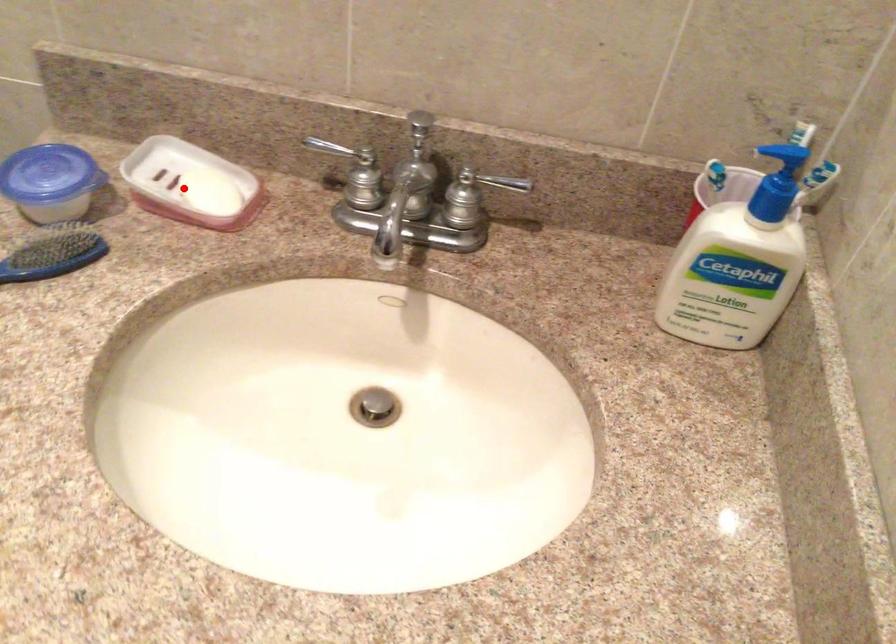
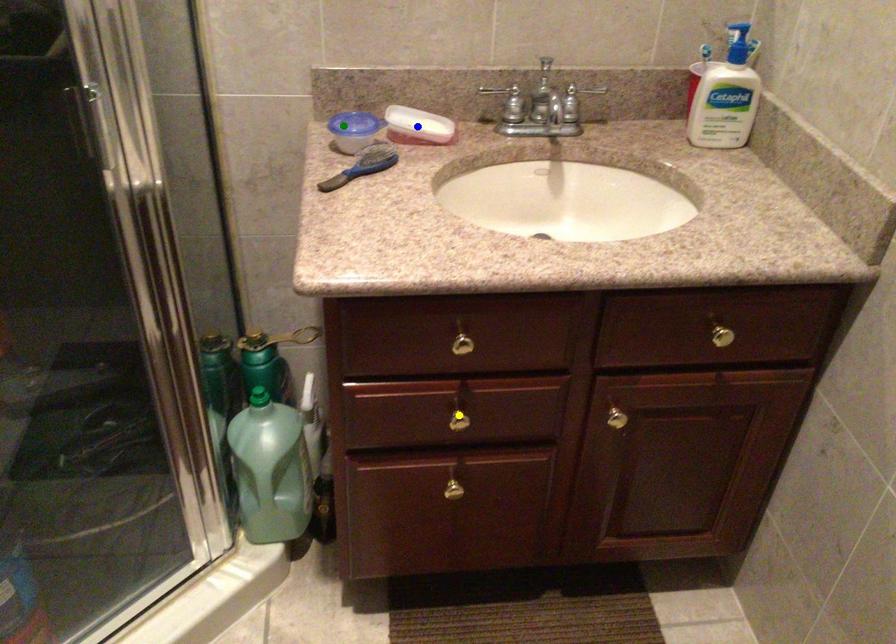
Question: I am providing you with two images of the same scene from different viewpoints. A red point is marked on the first image. You are given multiple points on the second image. In image 2, which mark is for the same physical point as the one in image 1?

Choices:
 (A) blue point
 (B) green point
 (C) yellow point

Answer: (A)